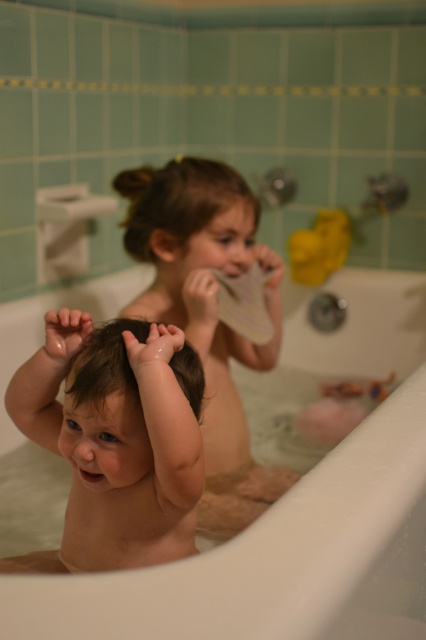
Question: Estimate the real-world distances between objects in this image. Which object is closer to the smooth skin child at center?

Choices:
 (A) smooth skin baby at center
 (B) smooth white bathtub at center

Answer: (A)

Question: Does smooth white bathtub at center appear on the left side of smooth skin child at center?

Choices:
 (A) no
 (B) yes

Answer: (A)

Question: Considering the relative positions of smooth white bathtub at center and smooth skin baby at center in the image provided, where is smooth white bathtub at center located with respect to smooth skin baby at center?

Choices:
 (A) above
 (B) below

Answer: (A)

Question: Among these objects, which one is nearest to the camera?

Choices:
 (A) smooth skin baby at center
 (B) smooth white bathtub at center

Answer: (A)

Question: Which point is farther to the camera?

Choices:
 (A) smooth skin child at center
 (B) smooth skin baby at center
 (C) smooth white bathtub at center

Answer: (C)

Question: Can you confirm if smooth skin baby at center is positioned to the right of smooth skin child at center?

Choices:
 (A) no
 (B) yes

Answer: (A)